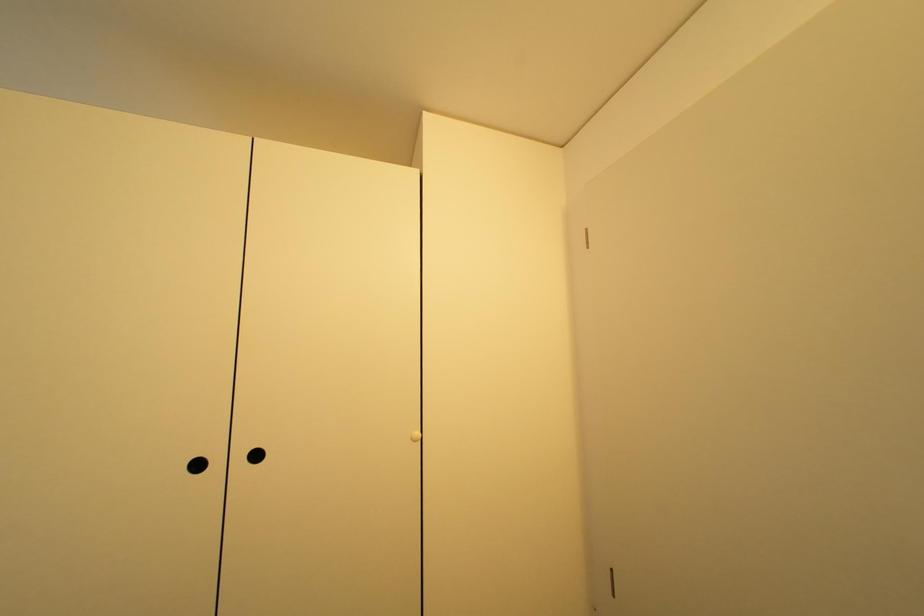
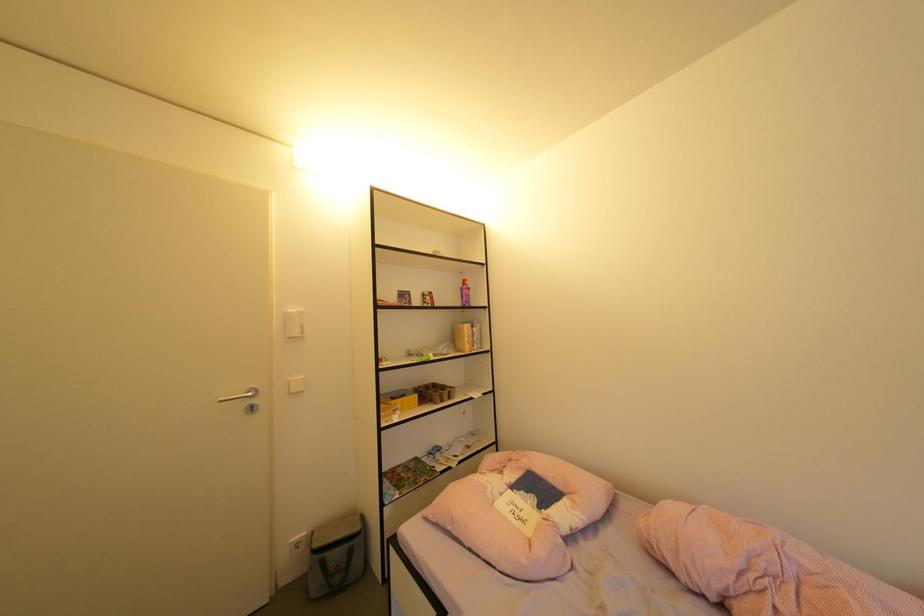
Question: The first image is from the beginning of the video and the second image is from the end. How did the camera likely rotate when shooting the video?

Choices:
 (A) Left
 (B) Right
 (C) Up
 (D) Down

Answer: (B)